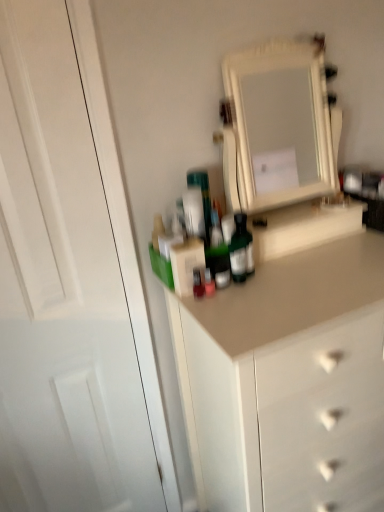
This screenshot has height=512, width=384. What do you see at coordinates (70, 285) in the screenshot?
I see `white glossy door at left` at bounding box center [70, 285].

Identify the location of white glossy door at left. (70, 285).

What do you see at coordinates (279, 123) in the screenshot? I see `white glossy medicine cabinet at upper center` at bounding box center [279, 123].

Locate an element on the screen. The width and height of the screenshot is (384, 512). white glossy medicine cabinet at upper center is located at coordinates tap(279, 123).

At what (x,y) coordinates should I click in order to perform the action: click on white glossy door at left. Please return your answer as a coordinate pair (x, y). Image resolution: width=384 pixels, height=512 pixels. Looking at the image, I should click on (70, 285).

Which object is positioned more to the left, white glossy door at left or white glossy medicine cabinet at upper center?

From the viewer's perspective, white glossy door at left appears more on the left side.

Which object is further away from the camera, white glossy door at left or white glossy medicine cabinet at upper center?

white glossy medicine cabinet at upper center is behind.

Does point (58, 195) come farther from viewer compared to point (231, 64)?

No, it is in front of (231, 64).

From the image's perspective, does white glossy door at left appear lower than white glossy medicine cabinet at upper center?

Correct, white glossy door at left appears lower than white glossy medicine cabinet at upper center in the image.

From a real-world perspective, between white glossy door at left and white glossy medicine cabinet at upper center, who is vertically higher?

From a 3D spatial view, white glossy medicine cabinet at upper center is above.

Which object is wider, white glossy door at left or white glossy medicine cabinet at upper center?

white glossy medicine cabinet at upper center.

Considering the sizes of objects white glossy door at left and white glossy medicine cabinet at upper center in the image provided, who is taller, white glossy door at left or white glossy medicine cabinet at upper center?

white glossy door at left is taller.

Considering the sizes of objects white glossy door at left and white glossy medicine cabinet at upper center in the image provided, who is smaller, white glossy door at left or white glossy medicine cabinet at upper center?

With smaller size is white glossy medicine cabinet at upper center.

Would you say white glossy door at left is inside or outside white glossy medicine cabinet at upper center?

white glossy door at left lies outside white glossy medicine cabinet at upper center.

Are white glossy door at left and white glossy medicine cabinet at upper center making contact?

white glossy door at left and white glossy medicine cabinet at upper center are clearly separated.

Is white glossy door at left positioned with its back to white glossy medicine cabinet at upper center?

No, white glossy door at left is not facing away from white glossy medicine cabinet at upper center.

How many degrees apart are the facing directions of white glossy door at left and white glossy medicine cabinet at upper center?

They differ by 1.65 degrees in their facing directions.

This screenshot has width=384, height=512. Identify the location of medicine cabinet behind the white glossy door at left. (279, 123).

Which is more to the right, white glossy medicine cabinet at upper center or white glossy door at left?

From the viewer's perspective, white glossy medicine cabinet at upper center appears more on the right side.

Which object is closer to the camera, white glossy medicine cabinet at upper center or white glossy door at left?

white glossy door at left.

Which point is more forward, (x=300, y=52) or (x=112, y=290)?

Point (x=300, y=52)

From the image's perspective, is white glossy medicine cabinet at upper center above or below white glossy door at left?

white glossy medicine cabinet at upper center is situated higher than white glossy door at left in the image.

From a real-world perspective, which object rests below the other?

white glossy door at left, from a real-world perspective.

Considering the sizes of objects white glossy medicine cabinet at upper center and white glossy door at left in the image provided, who is wider, white glossy medicine cabinet at upper center or white glossy door at left?

white glossy medicine cabinet at upper center is wider.

Who is shorter, white glossy medicine cabinet at upper center or white glossy door at left?

white glossy medicine cabinet at upper center is shorter.

Which of these two, white glossy medicine cabinet at upper center or white glossy door at left, is smaller?

white glossy medicine cabinet at upper center is smaller.

Would you say white glossy medicine cabinet at upper center is outside white glossy door at left?

Yes, white glossy medicine cabinet at upper center is outside of white glossy door at left.

Is there a large distance between white glossy medicine cabinet at upper center and white glossy door at left?

Absolutely, white glossy medicine cabinet at upper center is distant from white glossy door at left.

Is white glossy medicine cabinet at upper center aimed at white glossy door at left?

No, white glossy medicine cabinet at upper center is not turned towards white glossy door at left.

How different are the orientations of white glossy medicine cabinet at upper center and white glossy door at left in degrees?

The facing directions of white glossy medicine cabinet at upper center and white glossy door at left are 1.65 degrees apart.

The width and height of the screenshot is (384, 512). I want to click on glass door below the white glossy medicine cabinet at upper center (from the image's perspective), so click(70, 285).

This screenshot has width=384, height=512. I want to click on medicine cabinet above the white glossy door at left (from a real-world perspective), so click(279, 123).

The height and width of the screenshot is (512, 384). In order to click on glass door that appears below the white glossy medicine cabinet at upper center (from the image's perspective) in this screenshot , I will do `click(70, 285)`.